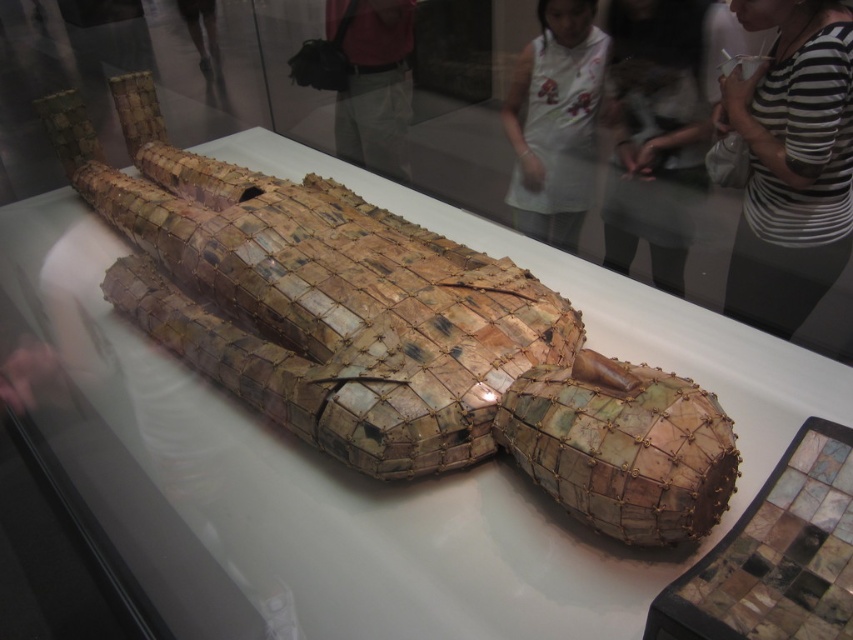
Between shiny metallic mosaic crocodile at center and white fabric at upper center, which one has more height?

With more height is shiny metallic mosaic crocodile at center.

Which is below, shiny metallic mosaic crocodile at center or white fabric at upper center?

Positioned lower is shiny metallic mosaic crocodile at center.

I want to click on shiny metallic mosaic crocodile at center, so coord(390,333).

Locate an element on the screen. white apron at upper center is located at coordinates (654, 134).

Which of these two, white apron at upper center or matte pink shirt at upper center, stands shorter?

Standing shorter between the two is matte pink shirt at upper center.

What are the coordinates of `white apron at upper center` in the screenshot? It's located at (654, 134).

Which of these two, white apron at upper center or white fabric at upper center, stands shorter?

With less height is white fabric at upper center.

Between point (671, 129) and point (514, 88), which one is positioned in front?

Point (671, 129) is more forward.

What do you see at coordinates (654, 134) in the screenshot?
I see `white apron at upper center` at bounding box center [654, 134].

Find the location of a particular element. The image size is (853, 640). white apron at upper center is located at coordinates (654, 134).